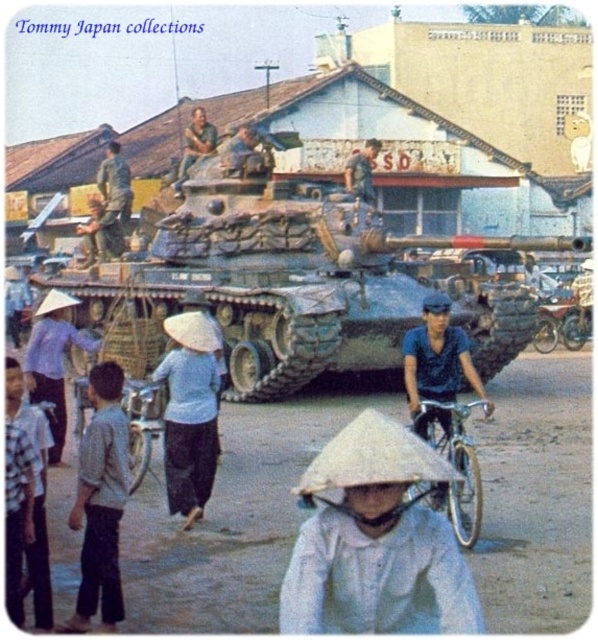
Question: Which of these objects is positioned farthest from the camouflage fabric helmet at upper center?

Choices:
 (A) camouflage fabric uniform at center
 (B) camouflage paint tank at center
 (C) camouflage fabric soldier at upper center
 (D) camouflage fabric tank at center

Answer: (B)

Question: Is camouflage paint tank at center positioned in front of white cotton conical hat at center?

Choices:
 (A) yes
 (B) no

Answer: (B)

Question: Among these objects, which one is farthest from the camera?

Choices:
 (A) metallic silver motorcycle at center
 (B) camouflage fabric soldier at upper center
 (C) camouflage paint tank at center
 (D) blue fabric shirt at center

Answer: (A)

Question: Does camouflage paint tank at center have a lesser width compared to camouflage fabric helmet at upper center?

Choices:
 (A) no
 (B) yes

Answer: (A)

Question: Which object is positioned closest to the matte blue shirt at left?

Choices:
 (A) silver metallic bicycle at lower center
 (B) white woven hat at lower center
 (C) matte gray bicycle at lower left

Answer: (C)

Question: Can you confirm if silver metallic bicycle at lower center is bigger than camouflage fabric helmet at upper center?

Choices:
 (A) yes
 (B) no

Answer: (B)